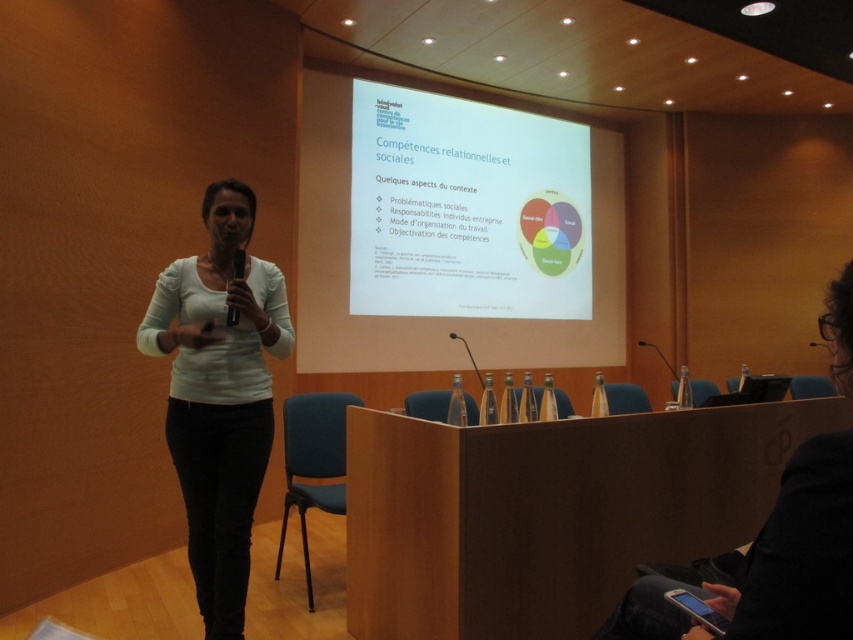
You are standing in the conference room and want to move to the point at coordinates point (248, 200). The room has a wooden floor. Can you walk directly to that point from where you are standing?

The point at coordinates point (248, 200) is 8.07 feet from the viewer, so yes, you can walk directly to that point from where you are standing as there is no obstruction mentioned in the scene description.

Consider the image. You are an attendee sitting in the conference room and want to take a photo of the white matte projection screen at upper center. To ensure the screen is centered in your photo, where should you position your camera horizontally and vertically?

To center the white matte projection screen at upper center in your photo, position your camera horizontally at 0.500 and vertically at 0.510.